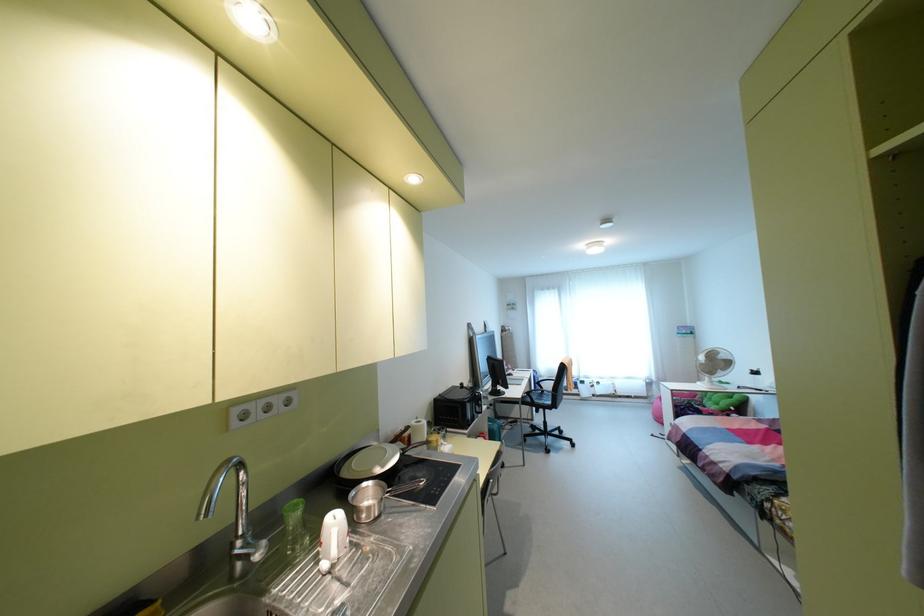
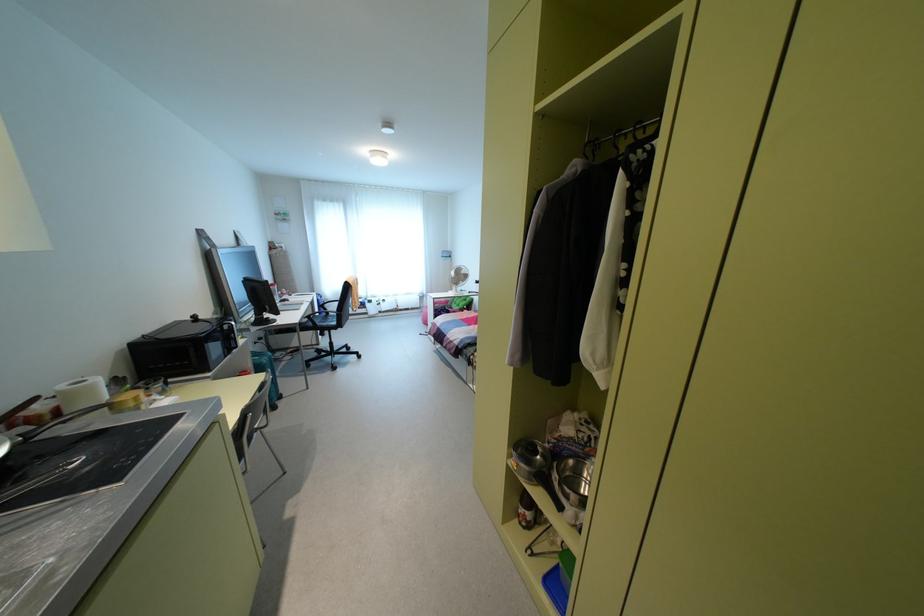
Find the pixel in the second image that matches the point at 528,392 in the first image.

(309, 315)